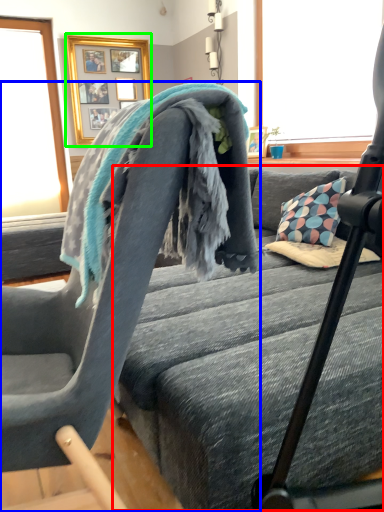
Question: Considering the real-world distances, which object is farthest from bed frame (highlighted by a red box)? chair (highlighted by a blue box) or picture frame (highlighted by a green box)?

Choices:
 (A) chair
 (B) picture frame

Answer: (B)